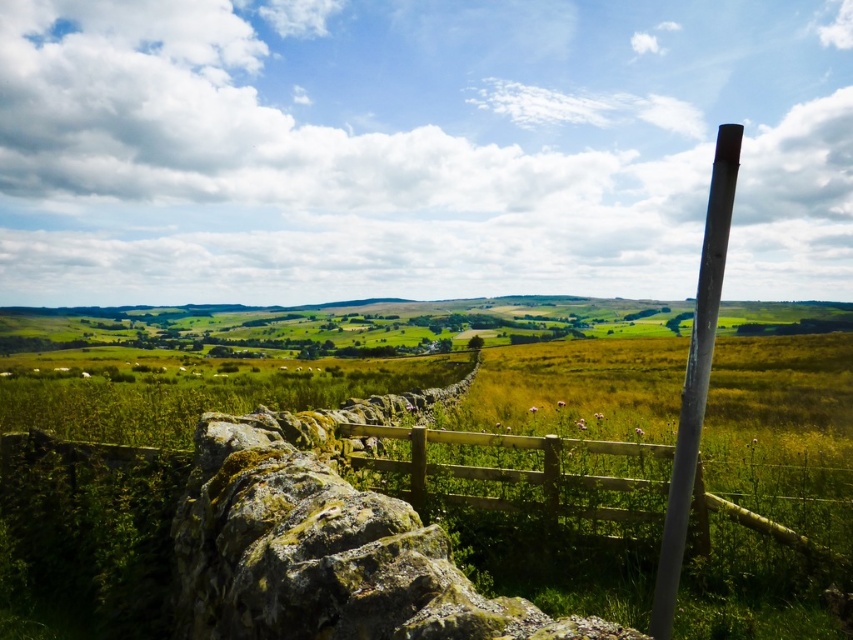
Question: Is wooden fence at center below white glossy pole at right?

Choices:
 (A) no
 (B) yes

Answer: (B)

Question: Among these points, which one is farthest from the camera?

Choices:
 (A) (540, 461)
 (B) (711, 282)

Answer: (A)

Question: Does wooden fence at center appear over white glossy pole at right?

Choices:
 (A) yes
 (B) no

Answer: (B)

Question: Does wooden fence at center have a larger size compared to white glossy pole at right?

Choices:
 (A) no
 (B) yes

Answer: (A)